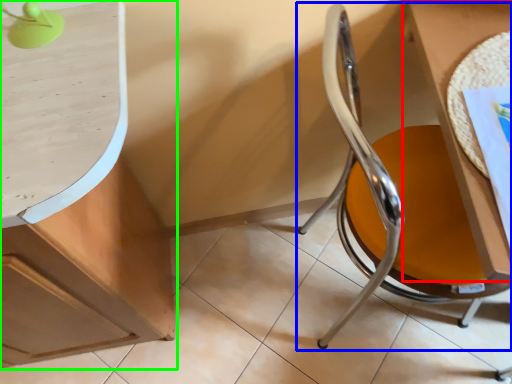
Question: Based on their relative distances, which object is farther from table (highlighted by a red box)? Choose from chair (highlighted by a blue box) and cabinetry (highlighted by a green box).

Choices:
 (A) chair
 (B) cabinetry

Answer: (B)